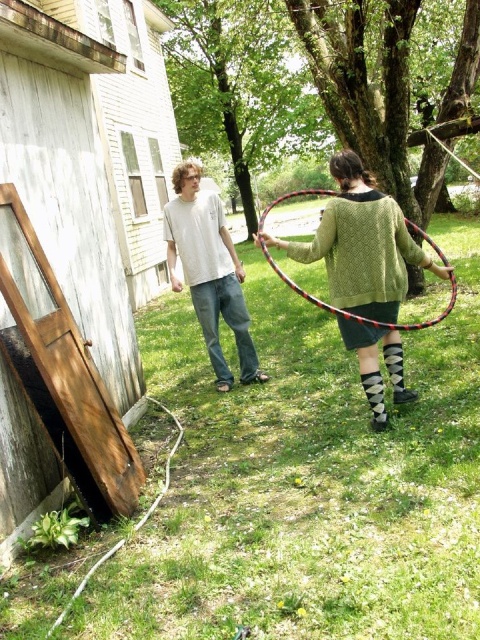
At what (x,y) coordinates should I click in order to perform the action: click on green knitted sweater at center. Please return your answer as a coordinate pair (x, y). Image resolution: width=480 pixels, height=640 pixels. Looking at the image, I should click on (364, 273).

Who is taller, green knitted sweater at center or white cotton t-shirt at center?

With more height is white cotton t-shirt at center.

Identify the location of green knitted sweater at center. (x=364, y=273).